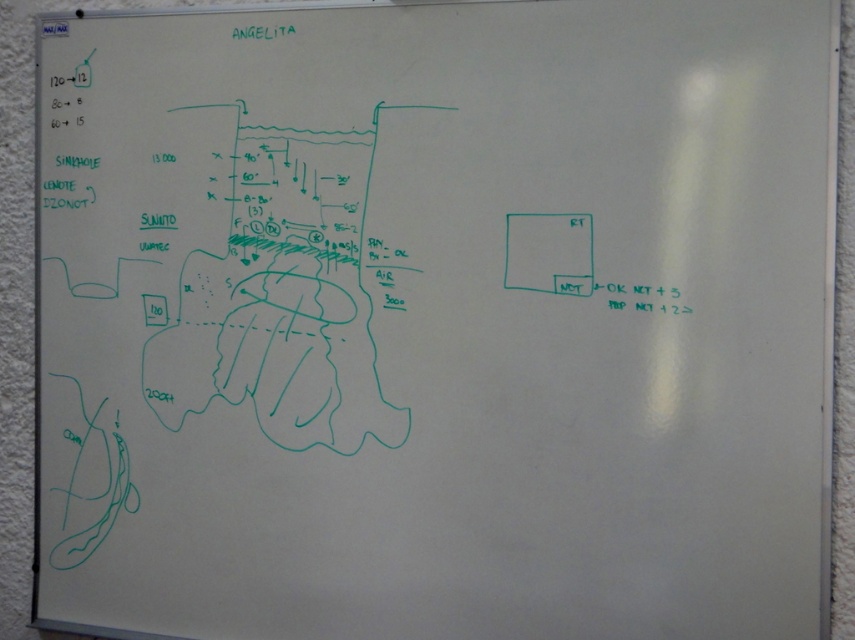
Question: Can you confirm if white paper at right is bigger than black ink at right?

Choices:
 (A) yes
 (B) no

Answer: (A)

Question: Which point is closer to the camera?

Choices:
 (A) white paper at right
 (B) black ink at right

Answer: (B)

Question: Can you confirm if white paper at right is positioned to the left of black ink at right?

Choices:
 (A) yes
 (B) no

Answer: (A)

Question: Does white paper at right have a greater width compared to black ink at right?

Choices:
 (A) no
 (B) yes

Answer: (A)